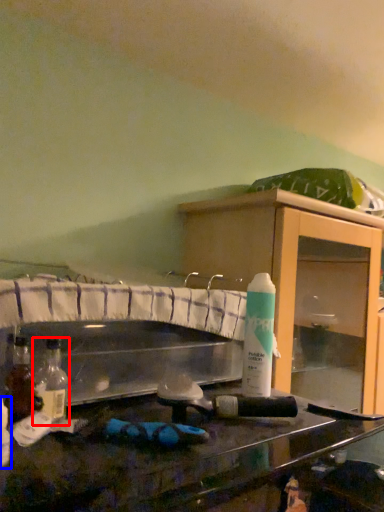
Question: Which object appears closest to the camera in this image, bottle (highlighted by a red box) or bottle (highlighted by a blue box)?

Choices:
 (A) bottle
 (B) bottle

Answer: (B)